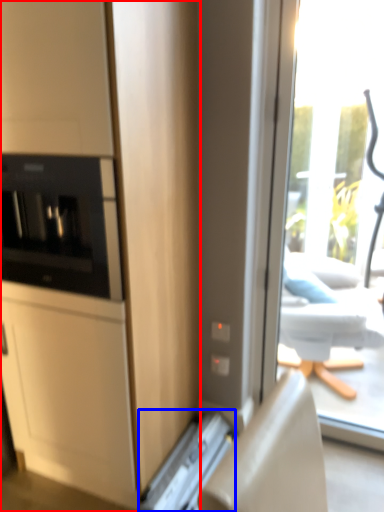
Question: Which point is closer to the camera, cabinetry (highlighted by a red box) or appliance (highlighted by a blue box)?

Choices:
 (A) cabinetry
 (B) appliance

Answer: (A)